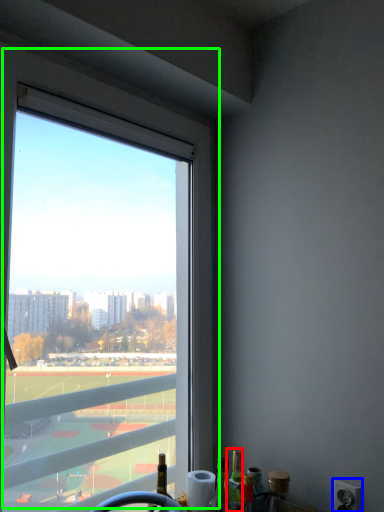
Question: Which object is positioned farthest from bottle (highlighted by a red box)? Select from power outlet (highlighted by a blue box) and window (highlighted by a green box).

Choices:
 (A) power outlet
 (B) window

Answer: (B)